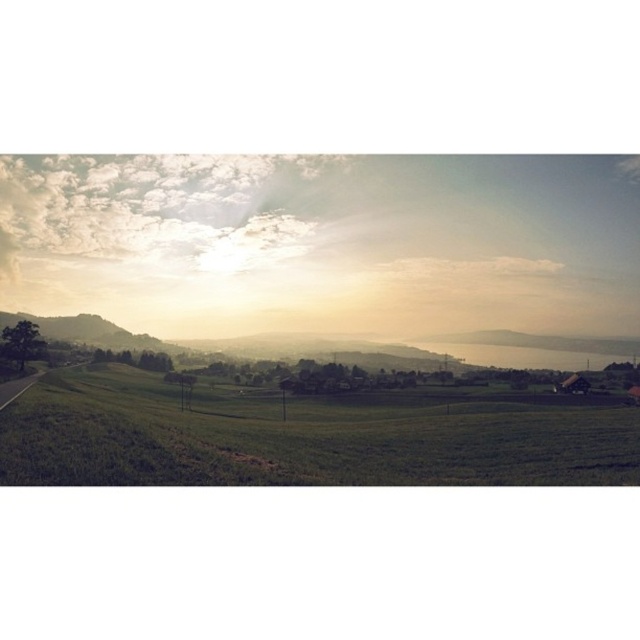
Who is shorter, green grassy field at lower left or golden haze landscape at center?

green grassy field at lower left

Does green grassy field at lower left have a greater height compared to golden haze landscape at center?

Incorrect, green grassy field at lower left's height is not larger of golden haze landscape at center's.

Between point (16, 433) and point (44, 323), which one is positioned behind?

The point (44, 323) is behind.

Where is `green grassy field at lower left`? The image size is (640, 640). green grassy field at lower left is located at coordinates (308, 436).